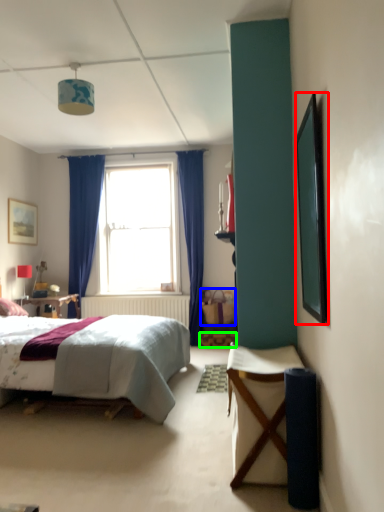
Question: Based on their relative distances, which object is nearer to picture frame (highlighted by a red box)? Choose from picnic basket (highlighted by a blue box) and stool (highlighted by a green box).

Choices:
 (A) picnic basket
 (B) stool

Answer: (A)